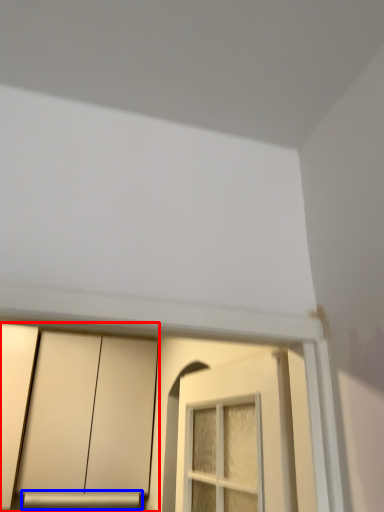
Question: Which object appears farthest to the camera in this image, cabinetry (highlighted by a red box) or window sill (highlighted by a blue box)?

Choices:
 (A) cabinetry
 (B) window sill

Answer: (B)